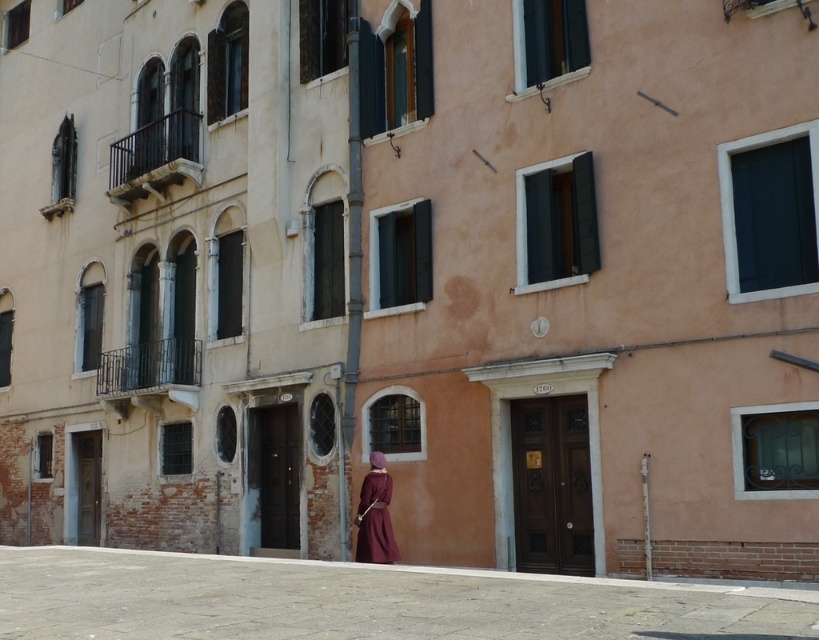
Between smooth concrete ground at lower center and velvet maroon dress at center, which one has less height?

Standing shorter between the two is velvet maroon dress at center.

Does point (258, 605) lie behind point (373, 554)?

No, it is not.

Is point (278, 561) closer to viewer compared to point (370, 464)?

Yes, it is in front of point (370, 464).

Find the location of a particular element. The image size is (819, 640). smooth concrete ground at lower center is located at coordinates (358, 602).